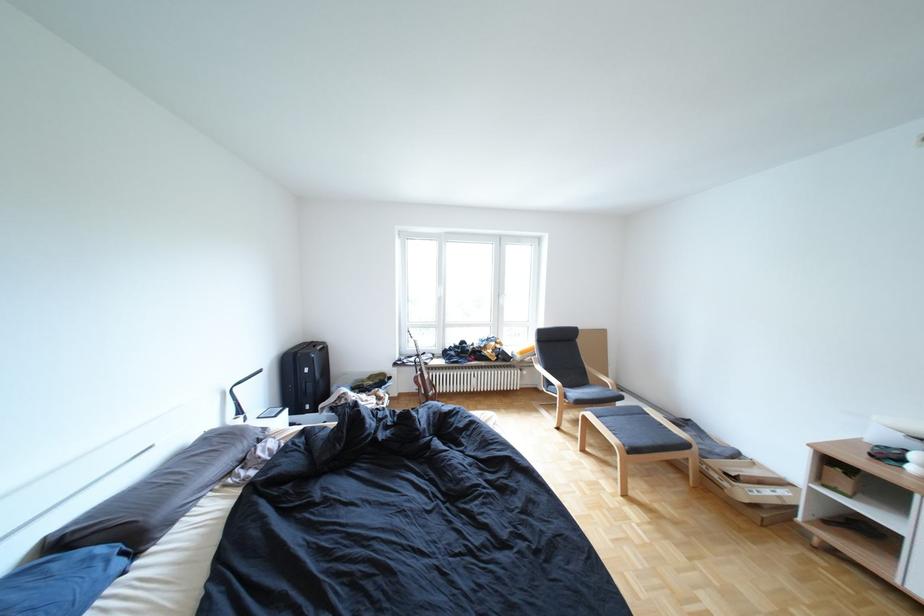
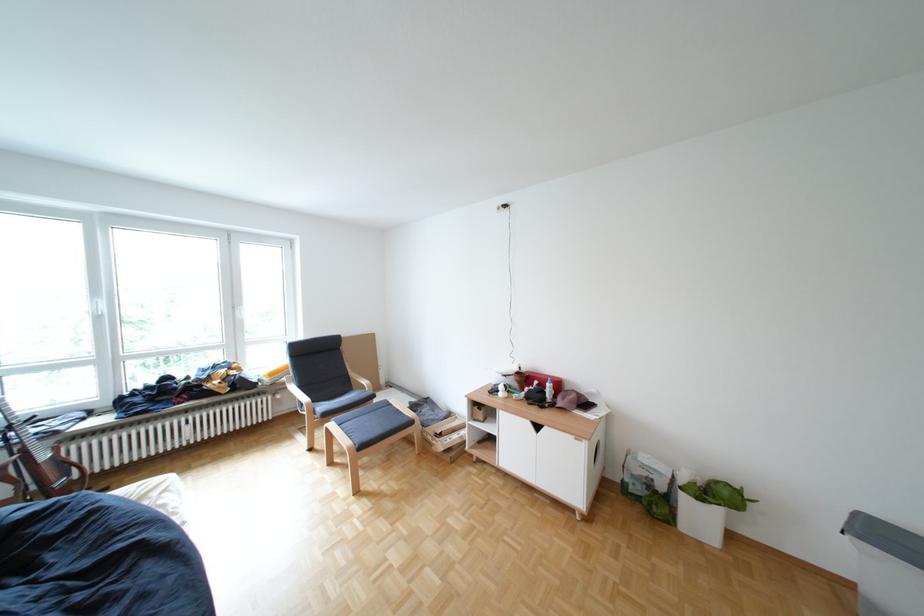
In the second image, find the point that corresponds to (x=456, y=299) in the first image.

(114, 318)